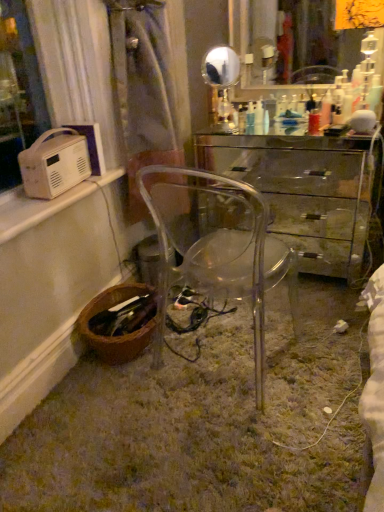
What do you see at coordinates (222, 81) in the screenshot? This screenshot has height=512, width=384. I see `gold metallic mirror at upper center, the 1th mirror when ordered from left to right` at bounding box center [222, 81].

Describe the element at coordinates (253, 35) in the screenshot. The image size is (384, 512). I see `transparent glass mirror at upper center, the 1th mirror when ordered from right to left` at that location.

Describe the element at coordinates (54, 163) in the screenshot. I see `white plastic radio at left, which appears as the first appliance when viewed from the front` at that location.

The height and width of the screenshot is (512, 384). What do you see at coordinates (118, 336) in the screenshot? I see `brown woven basket at lower left` at bounding box center [118, 336].

You are a GUI agent. You are given a task and a screenshot of the screen. Output one action in this format:
    pyautogui.click(x=<x>, y=<y>)
    Task: Click on the brown woven basket at lower left
    This screenshot has width=384, height=512.
    Given the screenshot: What is the action you would take?
    (118, 336)

What is the approximate height of white plastic radio at upper left, positioned as the 1th appliance in back-to-front order?

It is 21.03 centimeters.

Where is `transparent glass desk at center`? This screenshot has height=512, width=384. transparent glass desk at center is located at coordinates (310, 194).

Are gold metallic mirror at upper center, which is counted as the second mirror, starting from the right, and translucent plastic bottle at center far apart?

No.

Which is behind, gold metallic mirror at upper center, which is counted as the second mirror, starting from the right, or translucent plastic bottle at center?

translucent plastic bottle at center is further from the camera.

Which object is positioned more to the left, gold metallic mirror at upper center, the 1th mirror when ordered from left to right, or translucent plastic bottle at center?

From the viewer's perspective, gold metallic mirror at upper center, the 1th mirror when ordered from left to right, appears more on the left side.

From the image's perspective, is gold metallic mirror at upper center, the 1th mirror when ordered from left to right, beneath translucent plastic bottle at center?

Actually, gold metallic mirror at upper center, the 1th mirror when ordered from left to right, appears above translucent plastic bottle at center in the image.

In terms of width, does transparent plastic chair at center look wider or thinner when compared to white plastic radio at left, which appears as the first appliance when viewed from the front?

Considering their sizes, transparent plastic chair at center looks broader than white plastic radio at left, which appears as the first appliance when viewed from the front.

Looking at this image, which object is closer to the camera taking this photo, transparent plastic chair at center or white plastic radio at left, which appears as the first appliance when viewed from the front?

transparent plastic chair at center.

Considering the points (224, 199) and (60, 181), which point is in front, point (224, 199) or point (60, 181)?

Positioned in front is point (224, 199).

Which appliance is the 2nd one when counting from the left side of the transparent plastic chair at center? Please provide its 2D coordinates.

[(54, 163)]

Who is smaller, white plastic radio at upper left, the 2th appliance from the front, or transparent glass desk at center?

Smaller between the two is white plastic radio at upper left, the 2th appliance from the front.

Consider the image. Can you confirm if white plastic radio at upper left, positioned as the 1th appliance in back-to-front order, is positioned to the left of transparent glass desk at center?

Yes.

Considering the sizes of objects white plastic radio at upper left, positioned as the 1th appliance in back-to-front order, and transparent glass desk at center in the image provided, who is taller, white plastic radio at upper left, positioned as the 1th appliance in back-to-front order, or transparent glass desk at center?

transparent glass desk at center is taller.

From a real-world perspective, which is physically above, white plastic radio at upper left, positioned as the 1th appliance in back-to-front order, or transparent glass desk at center?

white plastic radio at upper left, positioned as the 1th appliance in back-to-front order.

Are translucent plastic bottle at center and transparent glass desk at center far apart?

translucent plastic bottle at center is actually quite close to transparent glass desk at center.

Looking at this image, is translucent plastic bottle at center taller or shorter than transparent glass desk at center?

translucent plastic bottle at center is shorter than transparent glass desk at center.

From a real-world perspective, is translucent plastic bottle at center over transparent glass desk at center?

Yes, from a real-world perspective, translucent plastic bottle at center is above transparent glass desk at center.

Does translucent plastic bottle at center have a lesser width compared to transparent glass desk at center?

Yes.

Is gold metallic mirror at upper center, which is counted as the second mirror, starting from the right, far away from white plastic radio at upper left, the 2th appliance from the front?

They are positioned close to each other.

Does point (219, 56) appear closer or farther from the camera than point (90, 148)?

Point (219, 56) is farther from the camera than point (90, 148).

Is gold metallic mirror at upper center, which is counted as the second mirror, starting from the right, turned away from white plastic radio at upper left, positioned as the 1th appliance in back-to-front order?

No, white plastic radio at upper left, positioned as the 1th appliance in back-to-front order, is not at the back of gold metallic mirror at upper center, which is counted as the second mirror, starting from the right.

Can you tell me how much gold metallic mirror at upper center, the 1th mirror when ordered from left to right, and white plastic radio at upper left, the 2th appliance from the front, differ in facing direction?

83 degrees separate the facing orientations of gold metallic mirror at upper center, the 1th mirror when ordered from left to right, and white plastic radio at upper left, the 2th appliance from the front.

Based on the photo, from a real-world perspective, which is physically above, transparent glass mirror at upper center, the 1th mirror when ordered from right to left, or white plastic radio at upper left, positioned as the 1th appliance in back-to-front order?

transparent glass mirror at upper center, the 1th mirror when ordered from right to left, is physically above.

Is transparent glass mirror at upper center, the 2th mirror positioned from the left, bigger than white plastic radio at upper left, the 2th appliance from the front?

Correct, transparent glass mirror at upper center, the 2th mirror positioned from the left, is larger in size than white plastic radio at upper left, the 2th appliance from the front.

Find the location of `the 2nd mirror positioned above the white plastic radio at upper left, the 2th appliance from the front (from a real-world perspective)`. the 2nd mirror positioned above the white plastic radio at upper left, the 2th appliance from the front (from a real-world perspective) is located at coordinates (253, 35).

Is transparent glass mirror at upper center, the 1th mirror when ordered from right to left, facing towards white plastic radio at upper left, the 2th appliance from the front?

Yes, transparent glass mirror at upper center, the 1th mirror when ordered from right to left, faces towards white plastic radio at upper left, the 2th appliance from the front.

Based on their positions, is translucent plastic bottle at center located to the left or right of white plastic radio at left, which appears as the first appliance when viewed from the front?

Clearly, translucent plastic bottle at center is on the right of white plastic radio at left, which appears as the first appliance when viewed from the front, in the image.

Is translucent plastic bottle at center far away from white plastic radio at left, the second appliance from the back?

Yes.

From the image's perspective, which appliance is the 2nd one below the translucent plastic bottle at center? Please provide its 2D coordinates.

[(54, 163)]

Locate an element on the screen. The height and width of the screenshot is (512, 384). mirror that is the 1st one when counting upward from the translucent plastic bottle at center (from the image's perspective) is located at coordinates (222, 81).

Image resolution: width=384 pixels, height=512 pixels. What are the coordinates of `appliance that is the 2nd one when counting leftward from the transparent plastic chair at center` in the screenshot? It's located at (54, 163).

When comparing their distances from transparent glass desk at center, does transparent plastic chair at center or white plastic radio at upper left, positioned as the 1th appliance in back-to-front order, seem further?

Among the two, white plastic radio at upper left, positioned as the 1th appliance in back-to-front order, is located further to transparent glass desk at center.

Estimate the real-world distances between objects in this image. Which object is further from white plastic radio at left, which appears as the first appliance when viewed from the front, transparent plastic chair at center or translucent plastic bottle at center?

translucent plastic bottle at center.

Looking at the image, which one is located closer to transparent glass desk at center, transparent glass mirror at upper center, the 1th mirror when ordered from right to left, or translucent plastic bottle at center?

translucent plastic bottle at center lies closer to transparent glass desk at center than the other object.

Estimate the real-world distances between objects in this image. Which object is closer to brown woven basket at lower left, transparent plastic chair at center or translucent plastic bottle at center?

transparent plastic chair at center lies closer to brown woven basket at lower left than the other object.

Looking at the image, which one is located further to white plastic radio at upper left, positioned as the 1th appliance in back-to-front order, gold metallic mirror at upper center, which is counted as the second mirror, starting from the right, or translucent plastic bottle at center?

Among the two, translucent plastic bottle at center is located further to white plastic radio at upper left, positioned as the 1th appliance in back-to-front order.

Considering their positions, is white plastic radio at left, the second appliance from the back, positioned closer to white plastic radio at upper left, the 2th appliance from the front, than brown woven basket at lower left?

The object closer to white plastic radio at upper left, the 2th appliance from the front, is white plastic radio at left, the second appliance from the back.

Looking at the image, which one is located further to transparent glass mirror at upper center, the 2th mirror positioned from the left, gold metallic mirror at upper center, the 1th mirror when ordered from left to right, or white plastic radio at upper left, the 2th appliance from the front?

white plastic radio at upper left, the 2th appliance from the front, lies further to transparent glass mirror at upper center, the 2th mirror positioned from the left, than the other object.

Estimate the real-world distances between objects in this image. Which object is closer to brown woven basket at lower left, white plastic radio at upper left, positioned as the 1th appliance in back-to-front order, or white plastic radio at left, the second appliance from the back?

white plastic radio at left, the second appliance from the back.

Where is `appliance between white plastic radio at left, the second appliance from the back, and gold metallic mirror at upper center, which is counted as the second mirror, starting from the right, from left to right`? The image size is (384, 512). appliance between white plastic radio at left, the second appliance from the back, and gold metallic mirror at upper center, which is counted as the second mirror, starting from the right, from left to right is located at coordinates (92, 146).

The image size is (384, 512). I want to click on desk between gold metallic mirror at upper center, the 1th mirror when ordered from left to right, and brown woven basket at lower left from top to bottom, so click(x=310, y=194).

Image resolution: width=384 pixels, height=512 pixels. I want to click on appliance between white plastic radio at left, the second appliance from the back, and transparent glass mirror at upper center, the 2th mirror positioned from the left, in the horizontal direction, so click(92, 146).

Identify the location of appliance located between white plastic radio at left, the second appliance from the back, and transparent plastic chair at center in the left-right direction. (92, 146).